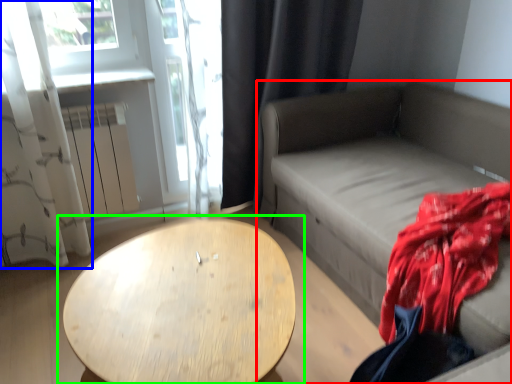
Question: Which object is the farthest from studio couch (highlighted by a red box)? Choose among these: curtain (highlighted by a blue box) or table (highlighted by a green box).

Choices:
 (A) curtain
 (B) table

Answer: (A)